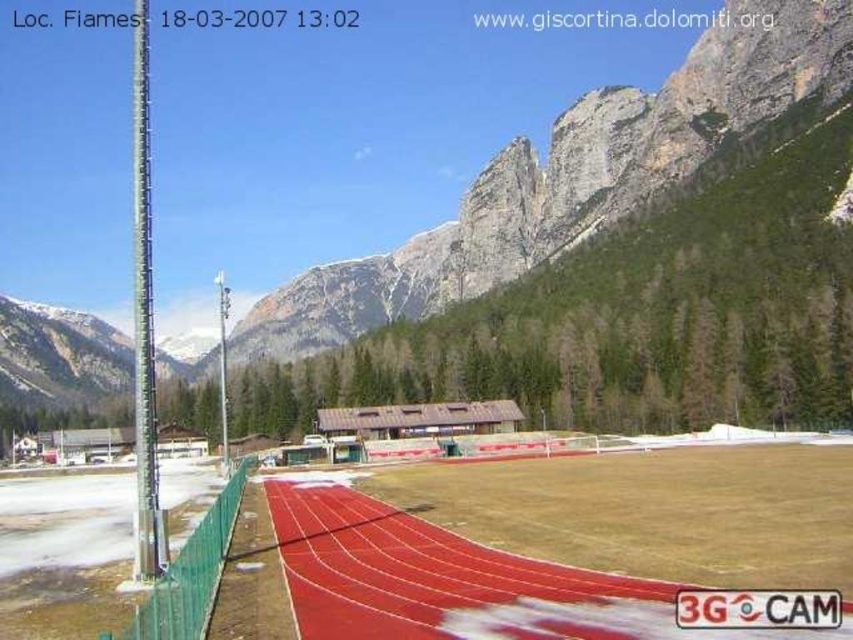
I want to click on green metallic pole at left, so click(x=143, y=316).